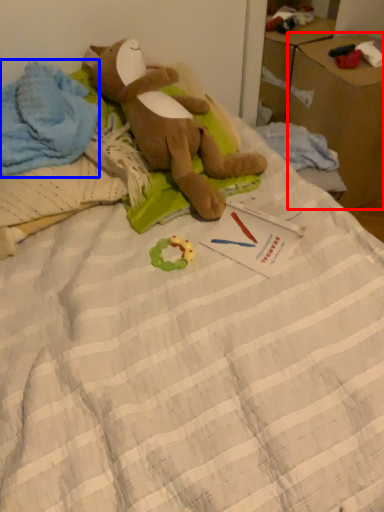
Question: Which object appears farthest to the camera in this image, cardboard box (highlighted by a red box) or clothing (highlighted by a blue box)?

Choices:
 (A) cardboard box
 (B) clothing

Answer: (A)